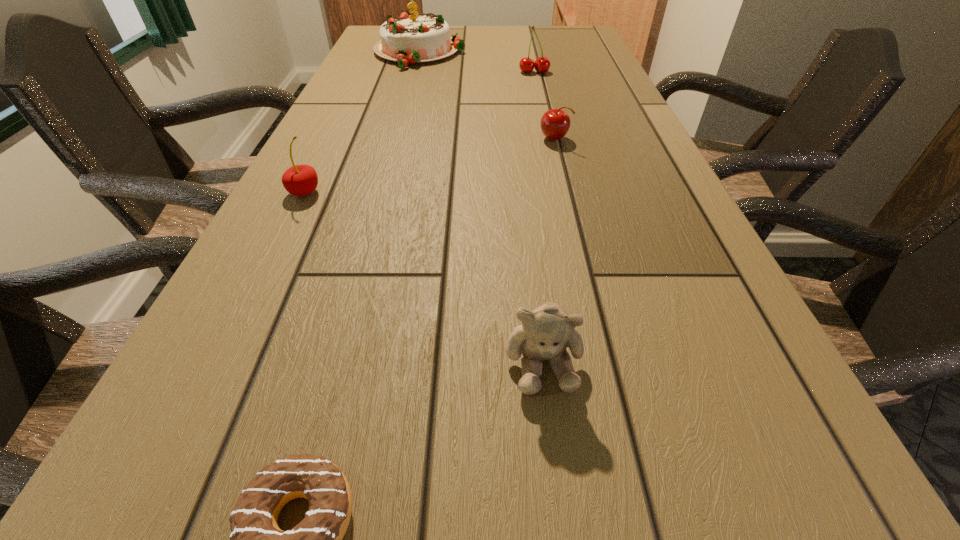
I want to click on cherry object that ranks as the second closest to the farthest cherry, so click(299, 180).

What are the coordinates of `free region that satisfies the following two spatial constraints: 1. with the stems of the farthest cherry pointing upwards; 2. on the right side of the second nearest cherry` in the screenshot? It's located at pos(549,139).